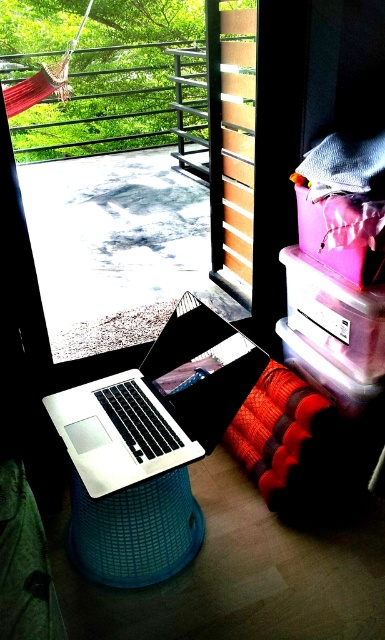
Is transparent glass door at upper center thinner than silver metallic laptop at center?

No, transparent glass door at upper center is not thinner than silver metallic laptop at center.

Which of these two, transparent glass door at upper center or silver metallic laptop at center, stands taller?

transparent glass door at upper center

Does point (68, 237) lie behind point (140, 467)?

Yes, it is behind point (140, 467).

Where is `transparent glass door at upper center`? The image size is (385, 640). transparent glass door at upper center is located at coordinates (145, 212).